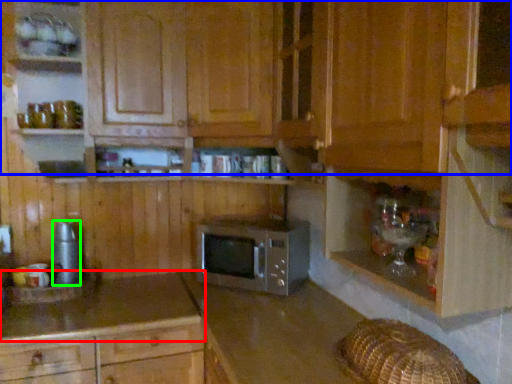
Question: Which object is the farthest from countertop (highlighted by a red box)? Choose among these: cabinetry (highlighted by a blue box) or appliance (highlighted by a green box).

Choices:
 (A) cabinetry
 (B) appliance

Answer: (A)